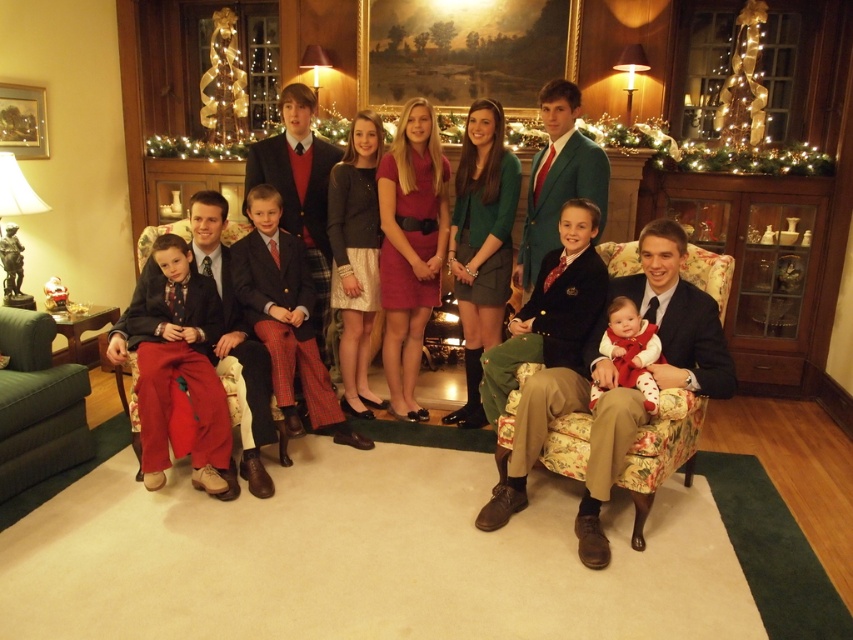
Question: Observing the image, what is the correct spatial positioning of matte red pants at lower left in reference to matte red dress at center?

Choices:
 (A) right
 (B) left

Answer: (B)

Question: Which point is farther to the camera?

Choices:
 (A) coord(675,269)
 (B) coord(647,406)
 (C) coord(137,321)

Answer: (C)

Question: Where is matte red pants at lower left located in relation to matte red dress at center in the image?

Choices:
 (A) right
 (B) left

Answer: (B)

Question: Which of the following is the closest to the observer?

Choices:
 (A) (709, 346)
 (B) (550, 410)
 (C) (28, 429)

Answer: (B)

Question: Among these points, which one is farthest from the camera?

Choices:
 (A) (721, 397)
 (B) (654, 360)
 (C) (27, 388)

Answer: (C)

Question: Can you confirm if matte black suit at center is positioned to the left of floral fabric armchair at center?

Choices:
 (A) yes
 (B) no

Answer: (A)